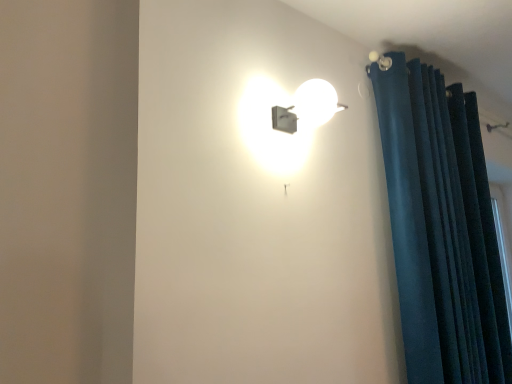
Question: From a real-world perspective, is dark blue velvet curtain at right positioned above or below matte white lamp at upper center?

Choices:
 (A) below
 (B) above

Answer: (A)

Question: Considering the positions of dark blue velvet curtain at right and matte white lamp at upper center in the image, is dark blue velvet curtain at right taller or shorter than matte white lamp at upper center?

Choices:
 (A) tall
 (B) short

Answer: (A)

Question: Visually, is dark blue velvet curtain at right positioned to the left or to the right of matte white lamp at upper center?

Choices:
 (A) left
 (B) right

Answer: (B)

Question: In the image, is matte white lamp at upper center positioned in front of or behind dark blue velvet curtain at right?

Choices:
 (A) front
 (B) behind

Answer: (A)

Question: From the image's perspective, is matte white lamp at upper center located above or below dark blue velvet curtain at right?

Choices:
 (A) above
 (B) below

Answer: (A)

Question: Does point (310, 107) appear closer or farther from the camera than point (464, 244)?

Choices:
 (A) farther
 (B) closer

Answer: (B)

Question: Looking at their shapes, would you say matte white lamp at upper center is wider or thinner than dark blue velvet curtain at right?

Choices:
 (A) wide
 (B) thin

Answer: (A)